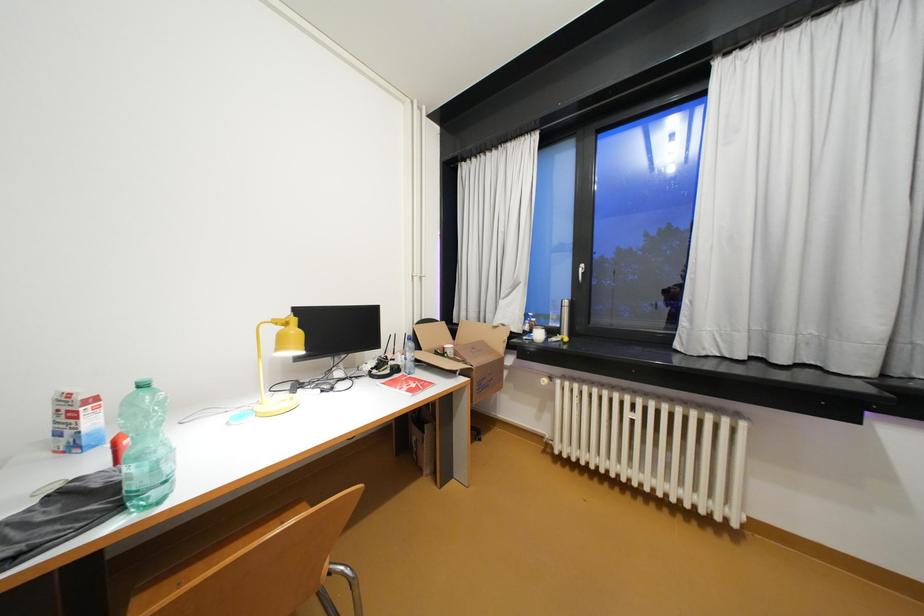
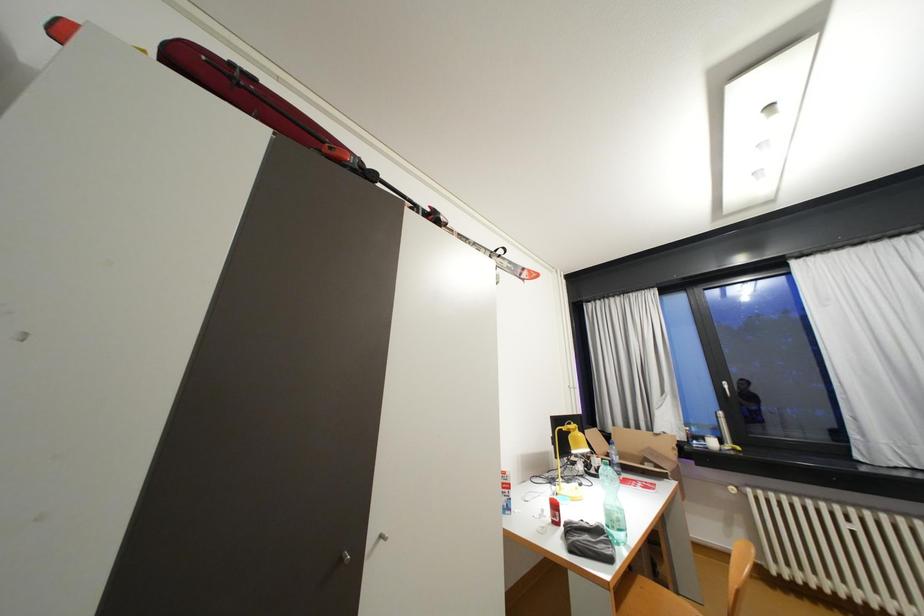
Which direction would the cameraman need to move to produce the second image?

The movement direction of the cameraman is left, backward.